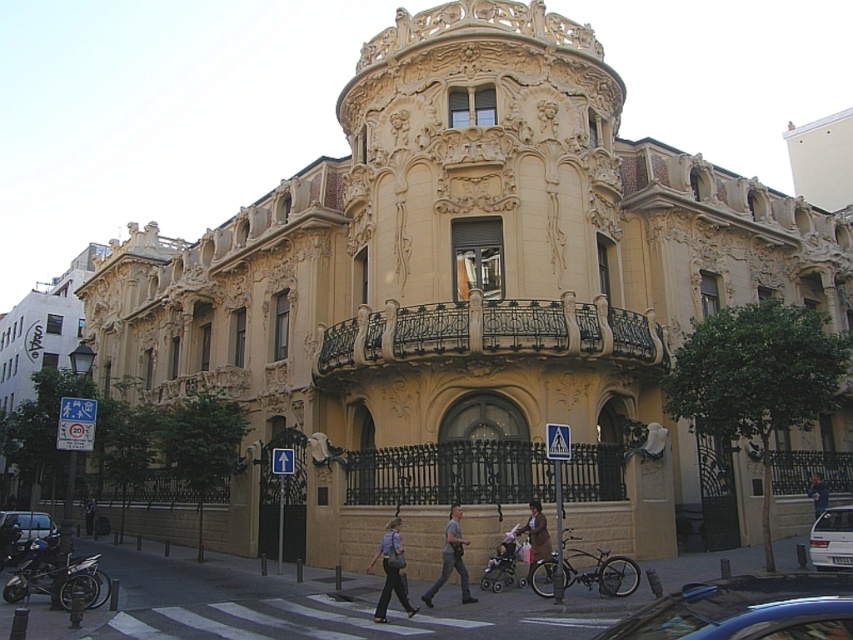
Is point (375, 616) less distant than point (3, 538)?

Yes.

You are a GUI agent. You are given a task and a screenshot of the screen. Output one action in this format:
    pyautogui.click(x=<x>, y=<y>)
    Task: Click on the dark gray pants at lower center
    The height and width of the screenshot is (640, 853).
    Given the screenshot: What is the action you would take?
    pyautogui.click(x=390, y=572)

Which is behind, point (380, 541) or point (18, 547)?

Point (18, 547)

At what (x,y) coordinates should I click in order to perform the action: click on dark gray pants at lower center. Please return your answer as a coordinate pair (x, y). Looking at the image, I should click on (390, 572).

Is point (785, 605) positioned after point (529, 524)?

That is False.

Locate an element on the screen. This screenshot has height=640, width=853. shiny blue car at lower right is located at coordinates (747, 609).

This screenshot has width=853, height=640. Find the location of `shiny blue car at lower right`. shiny blue car at lower right is located at coordinates (747, 609).

Which of these two, gray fabric pants at center or brown leather jacket at center, stands shorter?

gray fabric pants at center

How much distance is there between gray fabric pants at center and brown leather jacket at center?

22.86 feet

Which is in front, point (444, 560) or point (531, 556)?

Point (444, 560) is in front.

Where is `gray fabric pants at center`? Image resolution: width=853 pixels, height=640 pixels. gray fabric pants at center is located at coordinates (451, 560).